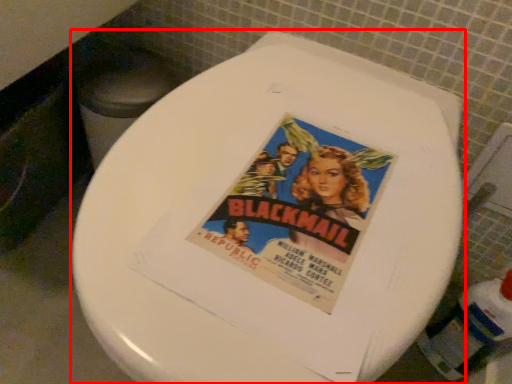
Question: From the image's perspective, what is the correct spatial relationship of toilet (annotated by the red box) in relation to bottle?

Choices:
 (A) above
 (B) below

Answer: (A)